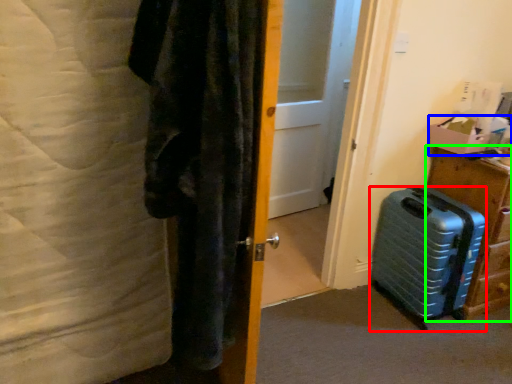
Question: Based on their relative distances, which object is nearer to suitcase (highlighted by a red box)? Choose from box (highlighted by a blue box) and furniture (highlighted by a green box).

Choices:
 (A) box
 (B) furniture

Answer: (B)